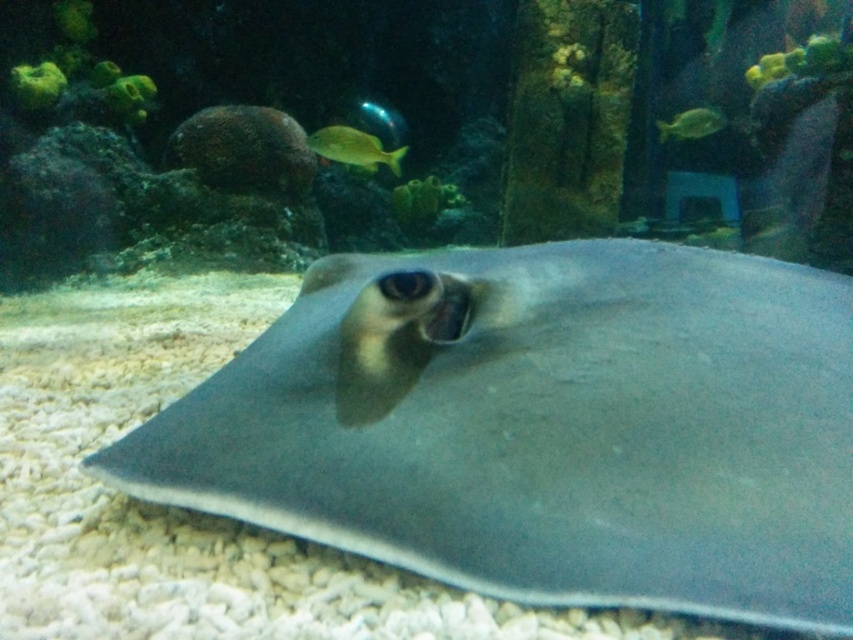
Question: Does smooth gray stingray at center have a greater width compared to yellow matte fish at upper center?

Choices:
 (A) yes
 (B) no

Answer: (A)

Question: Can you confirm if yellow matte fish at upper center is thinner than green shiny fish at upper right?

Choices:
 (A) yes
 (B) no

Answer: (B)

Question: Which of these objects is positioned closest to the yellow matte fish at upper center?

Choices:
 (A) smooth gray stingray at center
 (B) green shiny fish at upper right

Answer: (B)

Question: Which object is positioned closest to the smooth gray stingray at center?

Choices:
 (A) yellow matte fish at upper center
 (B) green shiny fish at upper right

Answer: (A)

Question: Is smooth gray stingray at center further to the viewer compared to yellow matte fish at upper center?

Choices:
 (A) no
 (B) yes

Answer: (A)

Question: Estimate the real-world distances between objects in this image. Which object is farther from the smooth gray stingray at center?

Choices:
 (A) yellow matte fish at upper center
 (B) green shiny fish at upper right

Answer: (B)